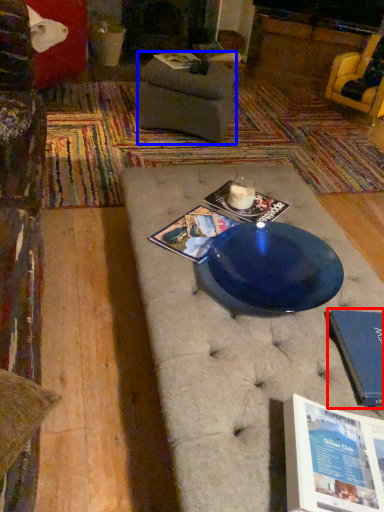
Question: Which object appears farthest to the camera in this image, paperback book (highlighted by a red box) or footrest (highlighted by a blue box)?

Choices:
 (A) paperback book
 (B) footrest

Answer: (B)